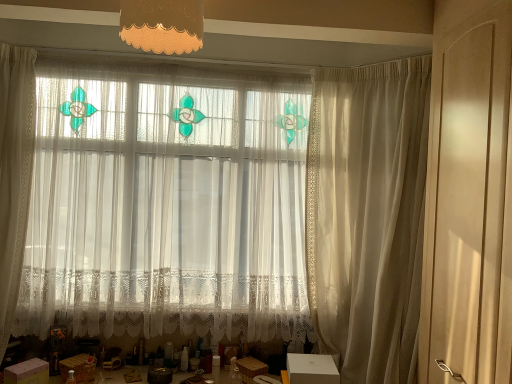
What do you see at coordinates (234, 212) in the screenshot?
I see `white lace curtain at center, which is the 2th curtain from right to left` at bounding box center [234, 212].

In order to face white cardboard box at lower left, which is the 1th cardboard box in left-to-right order, should I rotate leftwards or rightwards?

Rotate left and turn 27.957 degrees.

Measure the distance between point (407, 356) and camera.

The distance of point (407, 356) from camera is 1.88 meters.

This screenshot has height=384, width=512. What are the coordinates of `white lace curtain at center, positioned as the 1th curtain in left-to-right order` in the screenshot? It's located at (234, 212).

From a real-world perspective, which object rests below the other?

In real-world perspective, matte brown cardboard box at lower left, acting as the second cardboard box starting from the left, is lower.

Is white lace curtain at center, positioned as the 1th curtain in left-to-right order, turned away from matte brown cardboard box at lower left, which appears as the second cardboard box when viewed from the right?

white lace curtain at center, positioned as the 1th curtain in left-to-right order, is not turned away from matte brown cardboard box at lower left, which appears as the second cardboard box when viewed from the right.

Looking at this image, can you confirm if white lace curtain at center, which is the 2th curtain from right to left, is positioned to the left of matte brown cardboard box at lower left, acting as the second cardboard box starting from the left?

Incorrect, white lace curtain at center, which is the 2th curtain from right to left, is not on the left side of matte brown cardboard box at lower left, acting as the second cardboard box starting from the left.

What's the angular difference between white cardboard box at lower left, which is the 1th cardboard box in left-to-right order, and white lace curtain at center, which is the 2th curtain from right to left,'s facing directions?

55.7 degrees.

Who is more distant, white cardboard box at lower left, which is the 1th cardboard box in left-to-right order, or white lace curtain at center, positioned as the 1th curtain in left-to-right order?

Positioned behind is white lace curtain at center, positioned as the 1th curtain in left-to-right order.

Based on the photo, is white cardboard box at lower left, which is the 1th cardboard box in left-to-right order, bigger or smaller than white lace curtain at center, positioned as the 1th curtain in left-to-right order?

Clearly, white cardboard box at lower left, which is the 1th cardboard box in left-to-right order, is smaller in size than white lace curtain at center, positioned as the 1th curtain in left-to-right order.

Is matte brown cardboard box at lower left, which appears as the second cardboard box when viewed from the right, oriented towards white cardboard box at lower left, which is the 1th cardboard box in left-to-right order?

No, matte brown cardboard box at lower left, which appears as the second cardboard box when viewed from the right, is not facing towards white cardboard box at lower left, which is the 1th cardboard box in left-to-right order.

Is matte brown cardboard box at lower left, which appears as the second cardboard box when viewed from the right, to the left or to the right of white cardboard box at lower left, which is the 1th cardboard box in left-to-right order, in the image?

Based on their positions, matte brown cardboard box at lower left, which appears as the second cardboard box when viewed from the right, is located to the right of white cardboard box at lower left, which is the 1th cardboard box in left-to-right order.

Do you think matte brown cardboard box at lower left, which appears as the second cardboard box when viewed from the right, is within white cardboard box at lower left, which is the 1th cardboard box in left-to-right order, or outside of it?

matte brown cardboard box at lower left, which appears as the second cardboard box when viewed from the right, lies outside white cardboard box at lower left, which is the 1th cardboard box in left-to-right order.

From the image's perspective, which one is positioned higher, matte brown cardboard box at lower left, acting as the second cardboard box starting from the left, or white cardboard box at lower left, which is the 1th cardboard box in left-to-right order?

white cardboard box at lower left, which is the 1th cardboard box in left-to-right order, from the image's perspective.

In the scene shown: Which of these two, white cardboard box at lower left, which is the 1th cardboard box in left-to-right order, or matte brown cardboard box at lower left, which appears as the second cardboard box when viewed from the right, is smaller?

Smaller between the two is matte brown cardboard box at lower left, which appears as the second cardboard box when viewed from the right.

Can you confirm if white cardboard box at lower left, which is the third cardboard box in right-to-left order, is wider than matte brown cardboard box at lower left, which appears as the second cardboard box when viewed from the right?

Indeed, white cardboard box at lower left, which is the third cardboard box in right-to-left order, has a greater width compared to matte brown cardboard box at lower left, which appears as the second cardboard box when viewed from the right.

Is white cardboard box at lower left, which is the third cardboard box in right-to-left order, positioned far away from matte brown cardboard box at lower left, which appears as the second cardboard box when viewed from the right?

No, white cardboard box at lower left, which is the third cardboard box in right-to-left order, is in close proximity to matte brown cardboard box at lower left, which appears as the second cardboard box when viewed from the right.

Consider the image. Is white cardboard box at lower left, which is the third cardboard box in right-to-left order, shorter than matte brown cardboard box at lower left, acting as the second cardboard box starting from the left?

In fact, white cardboard box at lower left, which is the third cardboard box in right-to-left order, may be taller than matte brown cardboard box at lower left, acting as the second cardboard box starting from the left.

There is a matte orange fabric lampshade at upper center. What are the coordinates of `the 2nd curtain below it (from a real-world perspective)` in the screenshot? It's located at (368, 215).

In the scene shown: Can you confirm if matte orange fabric lampshade at upper center is thinner than sheer white curtain at right, which ranks as the second curtain in left-to-right order?

Indeed, matte orange fabric lampshade at upper center has a lesser width compared to sheer white curtain at right, which ranks as the second curtain in left-to-right order.

From a real-world perspective, is matte orange fabric lampshade at upper center below sheer white curtain at right, which ranks as the second curtain in left-to-right order?

Actually, matte orange fabric lampshade at upper center is physically above sheer white curtain at right, which ranks as the second curtain in left-to-right order, in the real world.

Consider the image. How different are the orientations of matte orange fabric lampshade at upper center and sheer white curtain at right, which ranks as the second curtain in left-to-right order, in degrees?

The angular difference between matte orange fabric lampshade at upper center and sheer white curtain at right, which ranks as the second curtain in left-to-right order, is 40.7 degrees.

From the image's perspective, which is above, matte beige screen door at right or sheer white curtain at right, the 1th curtain positioned from the right?

From the image's view, matte beige screen door at right is above.

From a real-world perspective, does matte beige screen door at right stand above sheer white curtain at right, the 1th curtain positioned from the right?

Correct, in the physical world, matte beige screen door at right is higher than sheer white curtain at right, the 1th curtain positioned from the right.

Between matte beige screen door at right and sheer white curtain at right, which ranks as the second curtain in left-to-right order, which one has less height?

matte beige screen door at right.

Which is further, (419, 351) or (336, 123)?

The point (336, 123) is farther from the camera.

Is sheer white curtain at right, the 1th curtain positioned from the right, positioned with its back to white lace curtain at center, positioned as the 1th curtain in left-to-right order?

sheer white curtain at right, the 1th curtain positioned from the right, is not turned away from white lace curtain at center, positioned as the 1th curtain in left-to-right order.

Is sheer white curtain at right, the 1th curtain positioned from the right, taller or shorter than white lace curtain at center, positioned as the 1th curtain in left-to-right order?

Clearly, sheer white curtain at right, the 1th curtain positioned from the right, is taller compared to white lace curtain at center, positioned as the 1th curtain in left-to-right order.

From the image's perspective, does sheer white curtain at right, which ranks as the second curtain in left-to-right order, appear lower than white lace curtain at center, which is the 2th curtain from right to left?

Yes, from the image's perspective, sheer white curtain at right, which ranks as the second curtain in left-to-right order, is below white lace curtain at center, which is the 2th curtain from right to left.

Considering the positions of objects sheer white curtain at right, which ranks as the second curtain in left-to-right order, and white lace curtain at center, positioned as the 1th curtain in left-to-right order, in the image provided, who is in front, sheer white curtain at right, which ranks as the second curtain in left-to-right order, or white lace curtain at center, positioned as the 1th curtain in left-to-right order,?

sheer white curtain at right, which ranks as the second curtain in left-to-right order, is closer to the camera.

This screenshot has width=512, height=384. What are the coordinates of `the 3rd cardboard box below the white lace curtain at center, positioned as the 1th curtain in left-to-right order (from the image's perspective)` in the screenshot? It's located at (79, 367).

Where is `the 2nd cardboard box counting from the left of the white lace curtain at center, which is the 2th curtain from right to left`? The height and width of the screenshot is (384, 512). the 2nd cardboard box counting from the left of the white lace curtain at center, which is the 2th curtain from right to left is located at coordinates (27, 372).

Considering their positions, is matte brown cardboard box at lower left, which appears as the second cardboard box when viewed from the right, positioned further to sheer white curtain at right, the 1th curtain positioned from the right, than white cardboard box at lower left, which is the third cardboard box in right-to-left order?

white cardboard box at lower left, which is the third cardboard box in right-to-left order, is further to sheer white curtain at right, the 1th curtain positioned from the right.

Based on their spatial positions, is white cardboard box at lower left, which is the third cardboard box in right-to-left order, or matte brown cardboard box at lower left, which appears as the second cardboard box when viewed from the right, further from white cardboard box at lower center, which is the first cardboard box from right to left?

white cardboard box at lower left, which is the third cardboard box in right-to-left order, lies further to white cardboard box at lower center, which is the first cardboard box from right to left, than the other object.

Looking at the image, which one is located closer to white cardboard box at lower left, which is the third cardboard box in right-to-left order, matte orange fabric lampshade at upper center or matte beige screen door at right?

Among the two, matte orange fabric lampshade at upper center is located nearer to white cardboard box at lower left, which is the third cardboard box in right-to-left order.

Considering their positions, is matte beige screen door at right positioned further to white cardboard box at lower left, which is the third cardboard box in right-to-left order, than white cardboard box at lower center, the 3th cardboard box viewed from the left?

matte beige screen door at right lies further to white cardboard box at lower left, which is the third cardboard box in right-to-left order, than the other object.

From the picture: When comparing their distances from matte beige screen door at right, does white lace curtain at center, positioned as the 1th curtain in left-to-right order, or white cardboard box at lower left, which is the 1th cardboard box in left-to-right order, seem closer?

white lace curtain at center, positioned as the 1th curtain in left-to-right order.

Estimate the real-world distances between objects in this image. Which object is further from white cardboard box at lower center, which is the first cardboard box from right to left, matte beige screen door at right or sheer white curtain at right, which ranks as the second curtain in left-to-right order?

The object further to white cardboard box at lower center, which is the first cardboard box from right to left, is matte beige screen door at right.

Considering their positions, is white lace curtain at center, positioned as the 1th curtain in left-to-right order, positioned closer to sheer white curtain at right, the 1th curtain positioned from the right, than white cardboard box at lower center, which is the first cardboard box from right to left?

white lace curtain at center, positioned as the 1th curtain in left-to-right order, lies closer to sheer white curtain at right, the 1th curtain positioned from the right, than the other object.

Which object lies nearer to the anchor point white cardboard box at lower left, which is the third cardboard box in right-to-left order, white lace curtain at center, positioned as the 1th curtain in left-to-right order, or matte brown cardboard box at lower left, acting as the second cardboard box starting from the left?

matte brown cardboard box at lower left, acting as the second cardboard box starting from the left, is closer to white cardboard box at lower left, which is the third cardboard box in right-to-left order.

Identify the location of curtain situated between white cardboard box at lower left, which is the third cardboard box in right-to-left order, and white cardboard box at lower center, which is the first cardboard box from right to left, from left to right. (234, 212).

I want to click on cardboard box between white cardboard box at lower left, which is the 1th cardboard box in left-to-right order, and white cardboard box at lower center, the 3th cardboard box viewed from the left, so click(79, 367).

The height and width of the screenshot is (384, 512). What are the coordinates of `curtain between white cardboard box at lower left, which is the 1th cardboard box in left-to-right order, and sheer white curtain at right, which ranks as the second curtain in left-to-right order` in the screenshot? It's located at (234, 212).

The image size is (512, 384). I want to click on curtain situated between matte brown cardboard box at lower left, which appears as the second cardboard box when viewed from the right, and sheer white curtain at right, the 1th curtain positioned from the right, from left to right, so click(x=234, y=212).